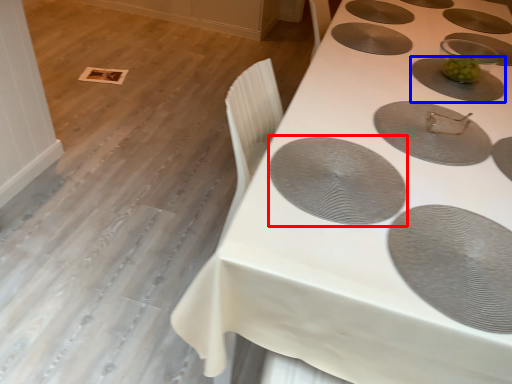
Question: Which object appears farthest to the camera in this image, oval (highlighted by a red box) or oval (highlighted by a blue box)?

Choices:
 (A) oval
 (B) oval

Answer: (B)